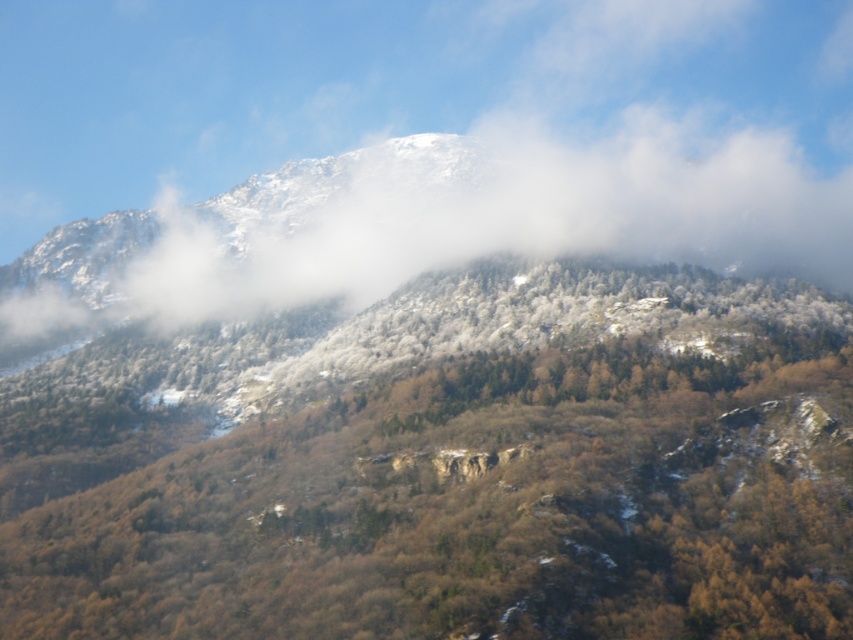
Who is positioned more to the right, green matte tree at center or white fluffy cloud at upper center?

Positioned to the right is green matte tree at center.

Can you confirm if green matte tree at center is positioned below white fluffy cloud at upper center?

Correct, green matte tree at center is located below white fluffy cloud at upper center.

This screenshot has height=640, width=853. Find the location of `green matte tree at center`. green matte tree at center is located at coordinates pyautogui.click(x=445, y=467).

This screenshot has height=640, width=853. I want to click on green matte tree at center, so click(x=445, y=467).